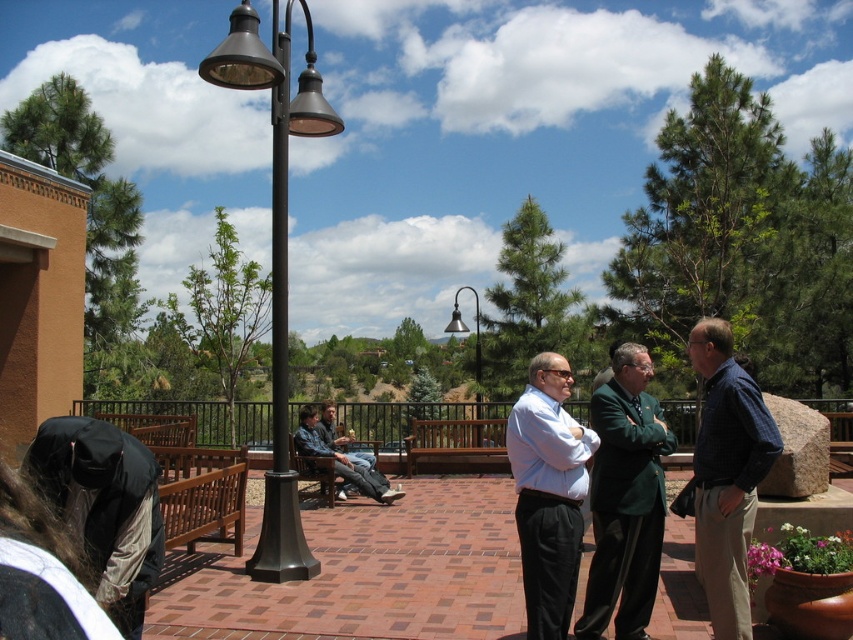
You are a delivery person trying to determine the best path to deliver a package to the black metal lamp post at center without stepping on the denim jacket at center. Which object should you avoid stepping on, and why?

You should avoid stepping on the denim jacket at center because the black metal lamp post at center is bigger and less likely to be obstructed by your path. However, since the denim jacket is smaller, it might be placed in a spot that requires careful navigation to avoid.

You are standing at point (276,252) in the image. What object is located exactly at your current position?

The black metal lamp post at center is located exactly at point (276,252).

What is the object located at the coordinates point (276, 252) in the image?

The point (276, 252) corresponds to the black metal lamp post at center.